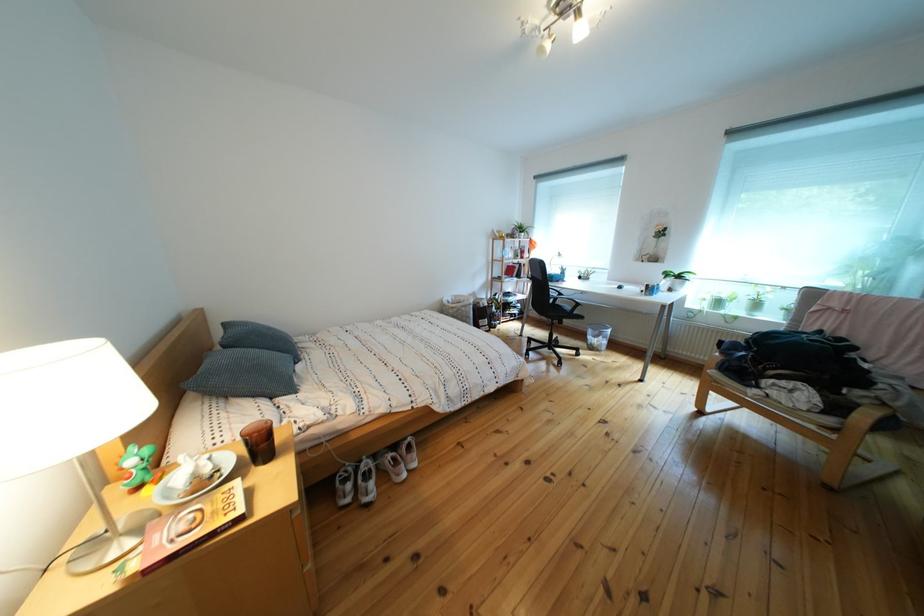
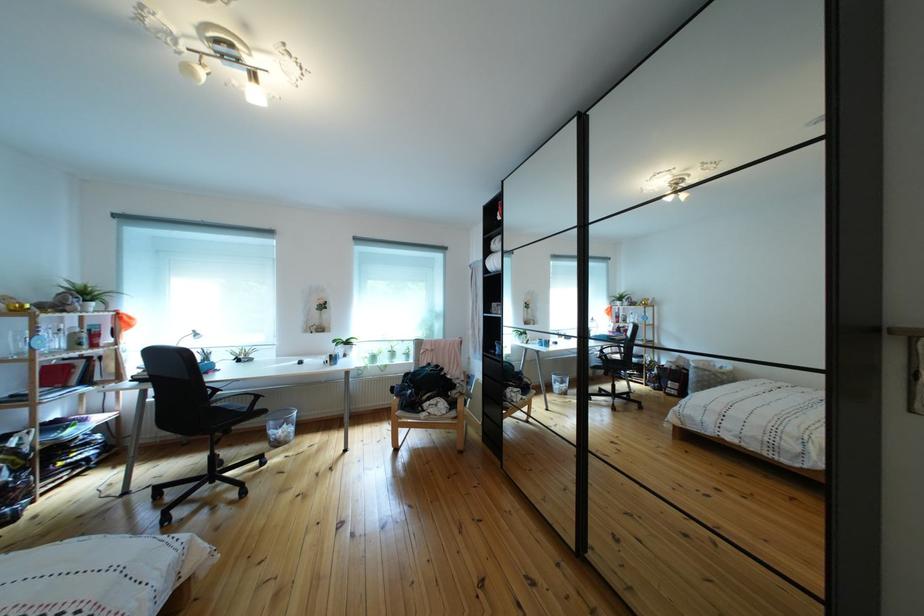
Find the pixel in the second image that matches (894,392) in the first image.

(469, 391)